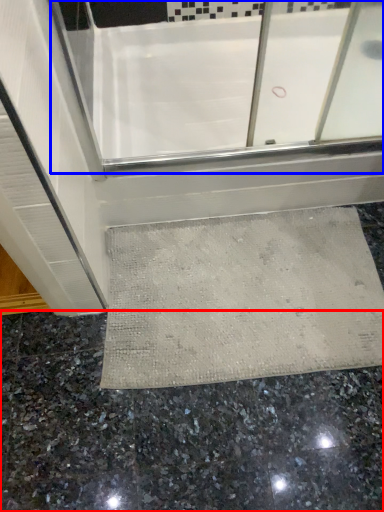
Question: Among these objects, which one is nearest to the camera, granite (highlighted by a red box) or bath (highlighted by a blue box)?

Choices:
 (A) granite
 (B) bath

Answer: (A)